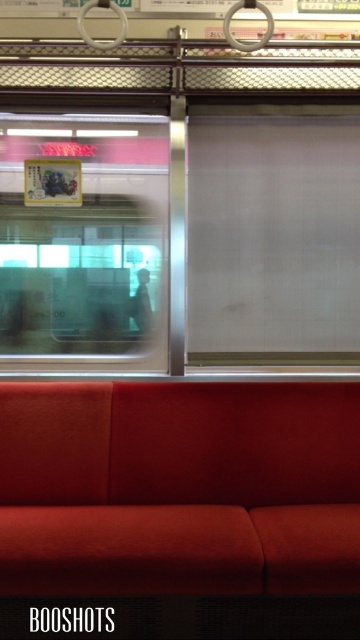
Question: Is transparent glass window at upper left to the right of smooth black jacket at center from the viewer's perspective?

Choices:
 (A) no
 (B) yes

Answer: (A)

Question: Which of the following is the farthest from the observer?

Choices:
 (A) smooth black jacket at center
 (B) transparent glass window at upper left

Answer: (A)

Question: Is transparent glass window at upper left wider than smooth black jacket at center?

Choices:
 (A) yes
 (B) no

Answer: (A)

Question: Is transparent glass window at upper left bigger than smooth black jacket at center?

Choices:
 (A) yes
 (B) no

Answer: (A)

Question: Which point is farther from the camera taking this photo?

Choices:
 (A) (125, 140)
 (B) (146, 321)

Answer: (B)